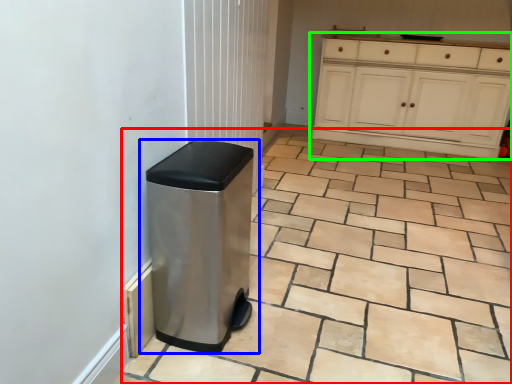
Question: Which object is positioned closest to ceramic tile (highlighted by a red box)? Select from waste container (highlighted by a blue box) and cabinetry (highlighted by a green box).

Choices:
 (A) waste container
 (B) cabinetry

Answer: (A)